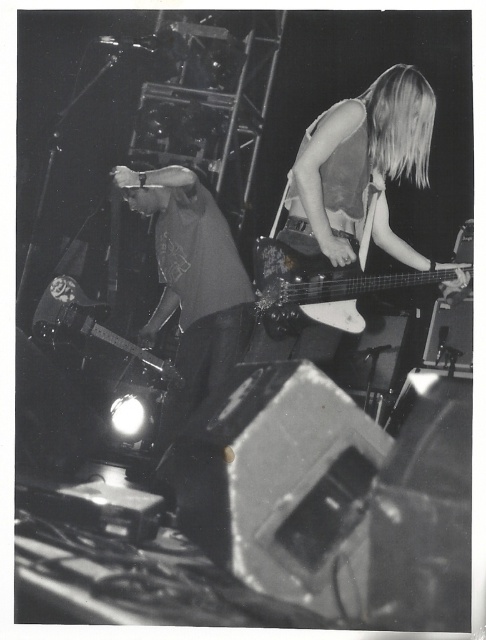
Question: Is dark gray fabric shirt at center closer to the viewer compared to shiny black electric guitar at left?

Choices:
 (A) no
 (B) yes

Answer: (B)

Question: Which object appears closest to the camera in this image?

Choices:
 (A) dark gray fabric shirt at center
 (B) shiny black electric guitar at left
 (C) shiny silver guitar at upper right

Answer: (C)

Question: From the image, what is the correct spatial relationship of shiny silver guitar at upper right in relation to shiny black electric guitar at left?

Choices:
 (A) left
 (B) right

Answer: (B)

Question: Which point appears farthest from the camera in this image?

Choices:
 (A) (171, 413)
 (B) (55, 321)

Answer: (B)

Question: Which point is farther to the camera?

Choices:
 (A) glossy black guitar at center
 (B) dark gray fabric shirt at center
 (C) shiny black electric guitar at left
 (D) shiny silver guitar at upper right

Answer: (C)

Question: Can you confirm if shiny silver guitar at upper right is positioned below shiny black electric guitar at left?

Choices:
 (A) no
 (B) yes

Answer: (A)